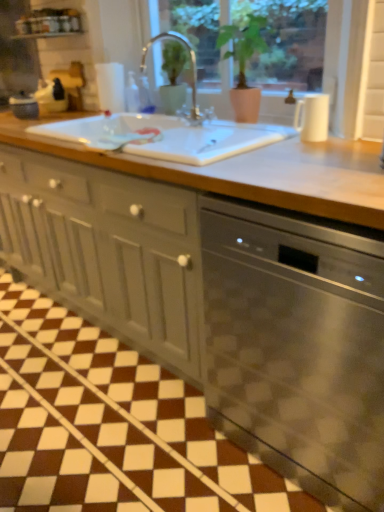
At what (x,y) coordinates should I click in order to perform the action: click on matte gray cabinet at center. Please return your answer as a coordinate pair (x, y). This screenshot has height=512, width=384. Looking at the image, I should click on (108, 249).

This screenshot has height=512, width=384. Describe the element at coordinates (312, 117) in the screenshot. I see `white matte pitcher at upper right, which appears as the 2th appliance when viewed from the back` at that location.

What do you see at coordinates (298, 345) in the screenshot? This screenshot has height=512, width=384. I see `stainless steel dishwasher at center` at bounding box center [298, 345].

Where is `white glossy window sill at upper center`? This screenshot has width=384, height=512. white glossy window sill at upper center is located at coordinates [x=45, y=35].

Is matte black kettle at left, the 2th appliance from the bottom, surrounded by white glossy window sill at upper center?

No, white glossy window sill at upper center does not contain matte black kettle at left, the 2th appliance from the bottom.

Considering the sizes of white glossy window sill at upper center and matte black kettle at left, marked as the 1th appliance in a top-to-bottom arrangement, in the image, is white glossy window sill at upper center wider or thinner than matte black kettle at left, marked as the 1th appliance in a top-to-bottom arrangement,?

white glossy window sill at upper center is wider than matte black kettle at left, marked as the 1th appliance in a top-to-bottom arrangement.

Which is further, (45,33) or (29,98)?

Positioned behind is point (29,98).

How different are the orientations of white glossy window sill at upper center and matte black kettle at left, the 2th appliance from the right, in degrees?

The angle between the facing direction of white glossy window sill at upper center and the facing direction of matte black kettle at left, the 2th appliance from the right, is 0.775 degrees.

Locate an element on the screen. window sill behind the white ceramic sink at center is located at coordinates (45, 35).

Is point (55, 35) farther from camera compared to point (213, 125)?

Yes, point (55, 35) is behind point (213, 125).

Is white glossy window sill at upper center with white ceramic sink at center?

They are not placed beside each other.

From the image's perspective, who appears lower, stainless steel dishwasher at center or white matte pitcher at upper right, acting as the first appliance starting from the bottom?

stainless steel dishwasher at center appears lower in the image.

Does stainless steel dishwasher at center have a greater width compared to white matte pitcher at upper right, acting as the first appliance starting from the bottom?

Yes.

Locate an element on the screen. Image resolution: width=384 pixels, height=512 pixels. home appliance below the white matte pitcher at upper right, arranged as the 1th appliance when viewed from the front (from the image's perspective) is located at coordinates pyautogui.click(x=298, y=345).

Would you consider stainless steel dishwasher at center to be distant from white matte pitcher at upper right, which appears as the 2th appliance when viewed from the back?

No, stainless steel dishwasher at center is in close proximity to white matte pitcher at upper right, which appears as the 2th appliance when viewed from the back.

Is point (274, 298) less distant than point (169, 34)?

Yes, it is.

From a real-world perspective, is stainless steel dishwasher at center located higher than satin nickel faucet at center?

No, from a real-world perspective, stainless steel dishwasher at center is not over satin nickel faucet at center

Considering the sizes of objects stainless steel dishwasher at center and satin nickel faucet at center in the image provided, who is shorter, stainless steel dishwasher at center or satin nickel faucet at center?

satin nickel faucet at center is shorter.

Can you confirm if stainless steel dishwasher at center is positioned to the left of satin nickel faucet at center?

In fact, stainless steel dishwasher at center is to the right of satin nickel faucet at center.

Is white ceramic sink at center positioned behind matte black kettle at left, marked as the 1th appliance in a top-to-bottom arrangement?

No, it is not.

From a real-world perspective, is white ceramic sink at center on top of matte black kettle at left, which is the 1th appliance from back to front?

No.

Does white ceramic sink at center have a lesser height compared to matte black kettle at left, the first appliance positioned from the left?

Yes.

This screenshot has height=512, width=384. Find the location of `the 1st appliance located beneath the white glossy window sill at upper center (from a real-world perspective)`. the 1st appliance located beneath the white glossy window sill at upper center (from a real-world perspective) is located at coordinates (24, 106).

Is matte black kettle at left, which is the 1th appliance from back to front, turned away from white glossy window sill at upper center?

matte black kettle at left, which is the 1th appliance from back to front, does not have its back to white glossy window sill at upper center.

Does matte black kettle at left, the 2th appliance from the right, appear on the left side of white glossy window sill at upper center?

Indeed, matte black kettle at left, the 2th appliance from the right, is positioned on the left side of white glossy window sill at upper center.

From a real-world perspective, between matte black kettle at left, marked as the 1th appliance in a top-to-bottom arrangement, and white glossy window sill at upper center, who is vertically higher?

From a 3D spatial view, white glossy window sill at upper center is above.

Is stainless steel dishwasher at center far from white ceramic sink at center?

They are positioned close to each other.

Could white ceramic sink at center be considered to be inside stainless steel dishwasher at center?

No, white ceramic sink at center is not a part of stainless steel dishwasher at center.

Locate an element on the screen. The image size is (384, 512). home appliance on the right side of white ceramic sink at center is located at coordinates (298, 345).

From the image's perspective, would you say stainless steel dishwasher at center is positioned over white ceramic sink at center?

Actually, stainless steel dishwasher at center appears below white ceramic sink at center in the image.

I want to click on the 1st appliance below the white glossy window sill at upper center (from the image's perspective), so click(x=24, y=106).

Where is `window sill on the left side of white ceramic sink at center`? window sill on the left side of white ceramic sink at center is located at coordinates (45, 35).

Which object lies further to the anchor point matte black kettle at left, marked as the 1th appliance in a top-to-bottom arrangement, stainless steel dishwasher at center or white ceramic sink at center?

stainless steel dishwasher at center.

When comparing their distances from stainless steel dishwasher at center, does satin nickel faucet at center or white matte pitcher at upper right, which appears as the 2th appliance when viewed from the back, seem closer?

white matte pitcher at upper right, which appears as the 2th appliance when viewed from the back.

Looking at the image, which one is located further to matte black kettle at left, marked as the 2th appliance in a front-to-back arrangement, matte gray cabinet at center or white matte pitcher at upper right, which appears as the 2th appliance when viewed from the back?

Based on the image, white matte pitcher at upper right, which appears as the 2th appliance when viewed from the back, appears to be further to matte black kettle at left, marked as the 2th appliance in a front-to-back arrangement.

Estimate the real-world distances between objects in this image. Which object is closer to white ceramic sink at center, matte black kettle at left, the first appliance positioned from the left, or stainless steel dishwasher at center?

Based on the image, stainless steel dishwasher at center appears to be nearer to white ceramic sink at center.

Estimate the real-world distances between objects in this image. Which object is closer to matte black kettle at left, the first appliance positioned from the left, stainless steel dishwasher at center or white glossy window sill at upper center?

white glossy window sill at upper center is closer to matte black kettle at left, the first appliance positioned from the left.

In the scene shown: Estimate the real-world distances between objects in this image. Which object is further from white ceramic sink at center, matte black kettle at left, which is the 1th appliance from back to front, or satin nickel faucet at center?

matte black kettle at left, which is the 1th appliance from back to front.

Which object lies further to the anchor point matte gray cabinet at center, white glossy window sill at upper center or satin nickel faucet at center?

white glossy window sill at upper center.

Looking at the image, which one is located further to satin nickel faucet at center, white ceramic sink at center or stainless steel dishwasher at center?

stainless steel dishwasher at center lies further to satin nickel faucet at center than the other object.

The height and width of the screenshot is (512, 384). What are the coordinates of `sink between matte gray cabinet at center and matte black kettle at left, the 2th appliance from the right, along the z-axis` in the screenshot? It's located at (164, 136).

In order to click on sink that lies between satin nickel faucet at center and matte gray cabinet at center from top to bottom in this screenshot , I will do `click(164, 136)`.

Find the location of `window sill between matte black kettle at left, the 2th appliance from the right, and satin nickel faucet at center, in the horizontal direction`. window sill between matte black kettle at left, the 2th appliance from the right, and satin nickel faucet at center, in the horizontal direction is located at coordinates (45, 35).

You are a GUI agent. You are given a task and a screenshot of the screen. Output one action in this format:
    pyautogui.click(x=<x>, y=<y>)
    Task: Click on the appliance between satin nickel faucet at center and stainless steel dishwasher at center vertically
    This screenshot has width=384, height=512.
    Given the screenshot: What is the action you would take?
    pyautogui.click(x=312, y=117)